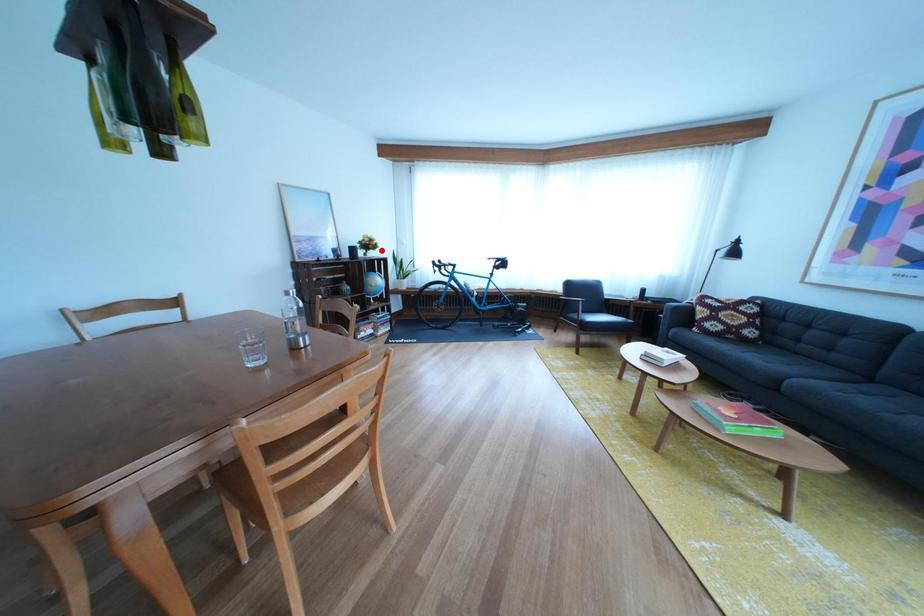
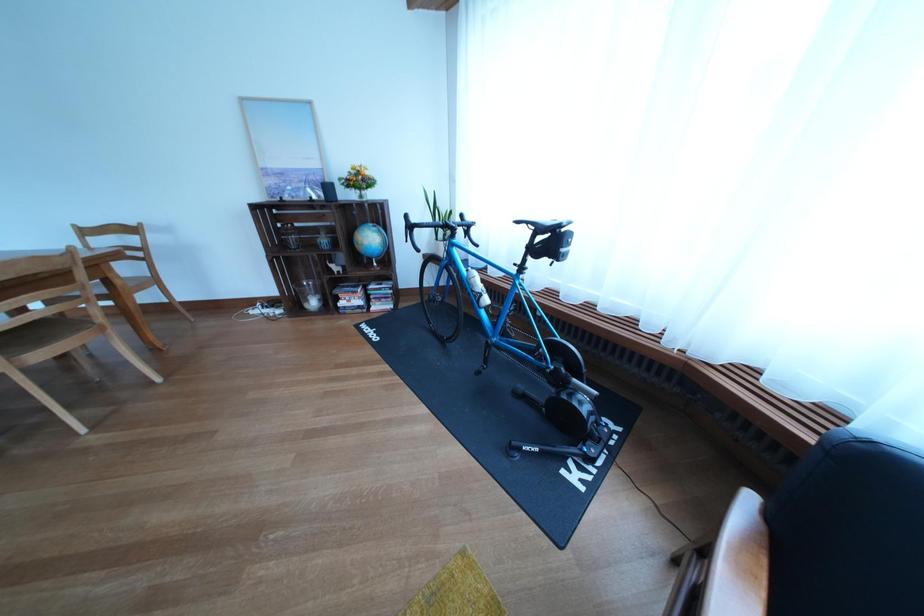
Find the pixel in the second image that matches the highlighted location in the first image.

(372, 185)